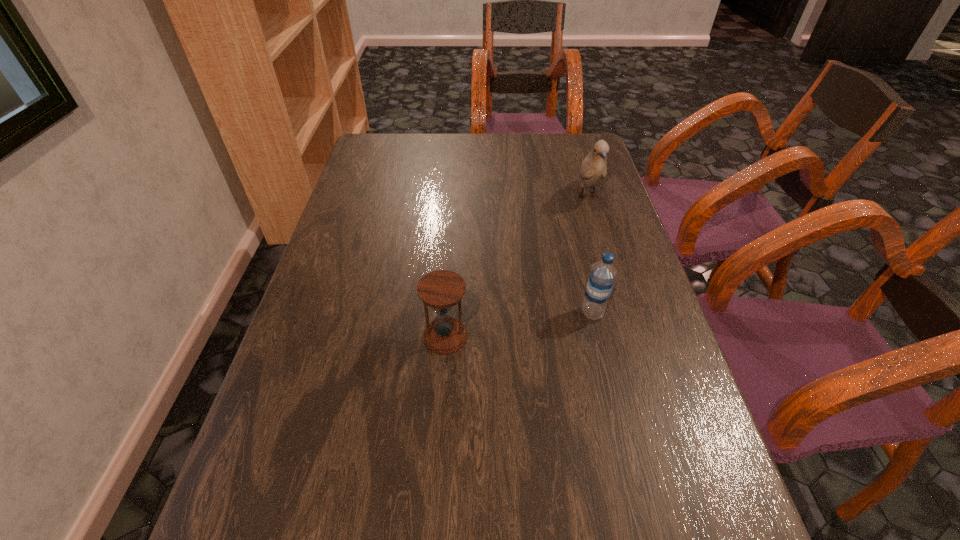
The width and height of the screenshot is (960, 540). Find the location of `the farthest object`. the farthest object is located at coordinates (593, 168).

What are the coordinates of `bird` in the screenshot? It's located at (593, 168).

The image size is (960, 540). What are the coordinates of `the second object from right to left` in the screenshot? It's located at (602, 276).

Locate an element on the screen. hourglass is located at coordinates (440, 290).

I want to click on vacant region located at the beak of the bird, so click(627, 329).

Where is `free space located 0.320m on the label of the water bottle`? Image resolution: width=960 pixels, height=540 pixels. free space located 0.320m on the label of the water bottle is located at coordinates (435, 313).

Image resolution: width=960 pixels, height=540 pixels. What are the coordinates of `vacant space located 0.260m on the label of the water bottle` in the screenshot? It's located at (462, 313).

You are a GUI agent. You are given a task and a screenshot of the screen. Output one action in this format:
    pyautogui.click(x=<x>, y=<y>)
    Task: Click on the free space located 0.110m on the label of the water bottle
    This screenshot has height=540, width=960.
    Given the screenshot: What is the action you would take?
    pyautogui.click(x=530, y=313)

At what (x,y) coordinates should I click in order to perform the action: click on free space located on the right of the hourglass. Please return your answer as a coordinate pair (x, y). The width and height of the screenshot is (960, 540). Looking at the image, I should click on (539, 337).

I want to click on bird present at the right edge, so click(593, 168).